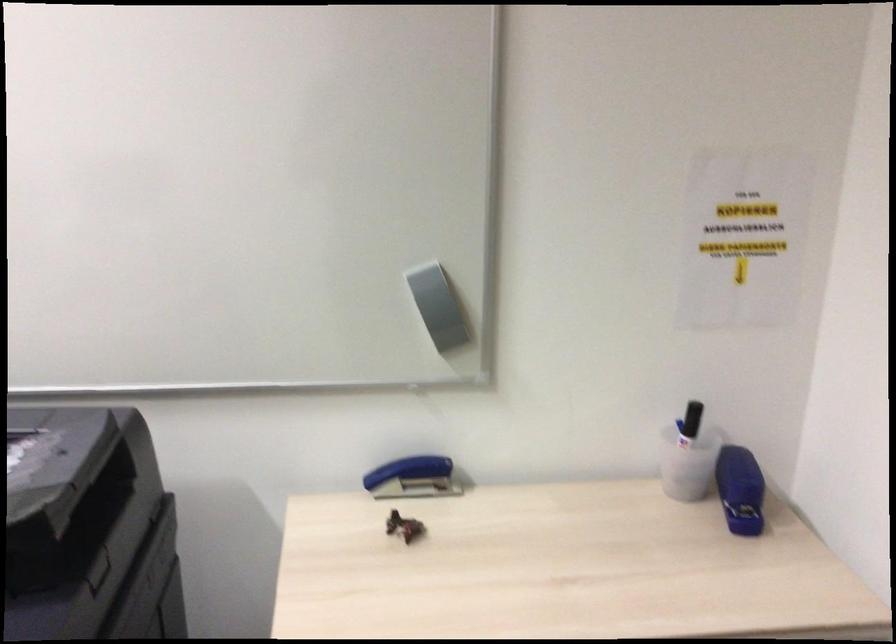
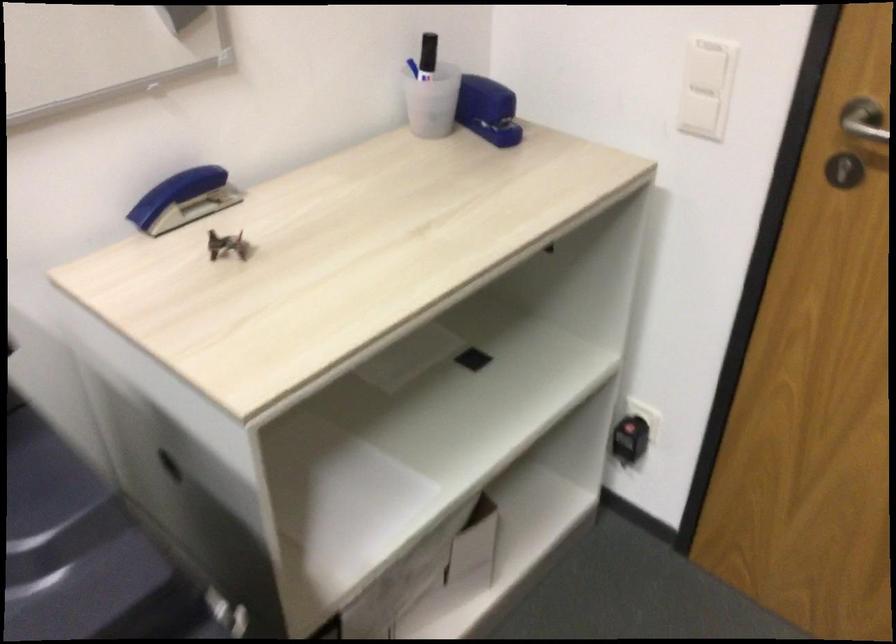
Based on the continuous images, in which direction is the camera rotating?

The rotation direction of the camera is right-down.